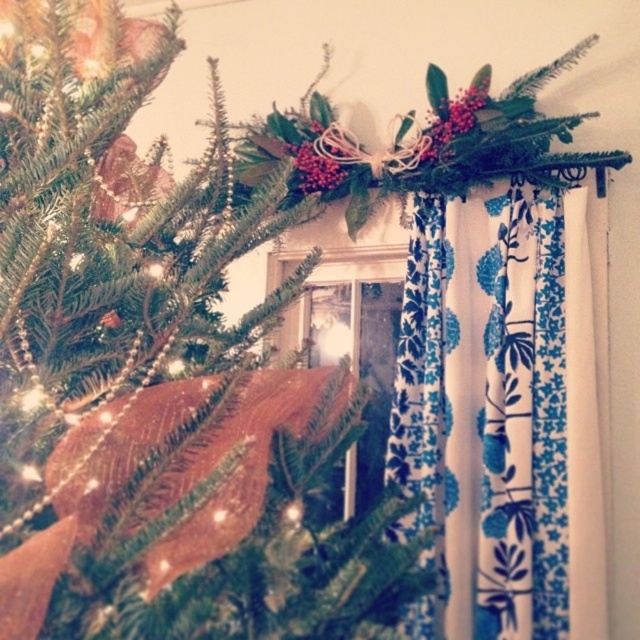
Question: Can you confirm if green matte christmas tree at upper left is positioned above blue floral fabric curtain at upper center?

Choices:
 (A) yes
 (B) no

Answer: (A)

Question: Can you confirm if green matte christmas tree at upper left is wider than blue floral fabric curtain at upper center?

Choices:
 (A) no
 (B) yes

Answer: (B)

Question: Which of the following is the farthest from the observer?

Choices:
 (A) green matte christmas tree at upper left
 (B) blue floral fabric curtain at upper center

Answer: (B)

Question: Which object is farther from the camera taking this photo?

Choices:
 (A) blue floral fabric curtain at upper center
 (B) green matte christmas tree at upper left

Answer: (A)

Question: Among these objects, which one is nearest to the camera?

Choices:
 (A) green matte christmas tree at upper left
 (B) blue floral fabric curtain at upper center

Answer: (A)

Question: Does green matte christmas tree at upper left appear under blue floral fabric curtain at upper center?

Choices:
 (A) yes
 (B) no

Answer: (B)